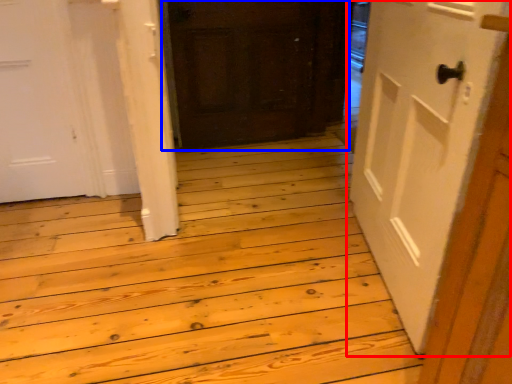
Question: Which of the following is the closest to the observer, door (highlighted by a red box) or door (highlighted by a blue box)?

Choices:
 (A) door
 (B) door

Answer: (A)